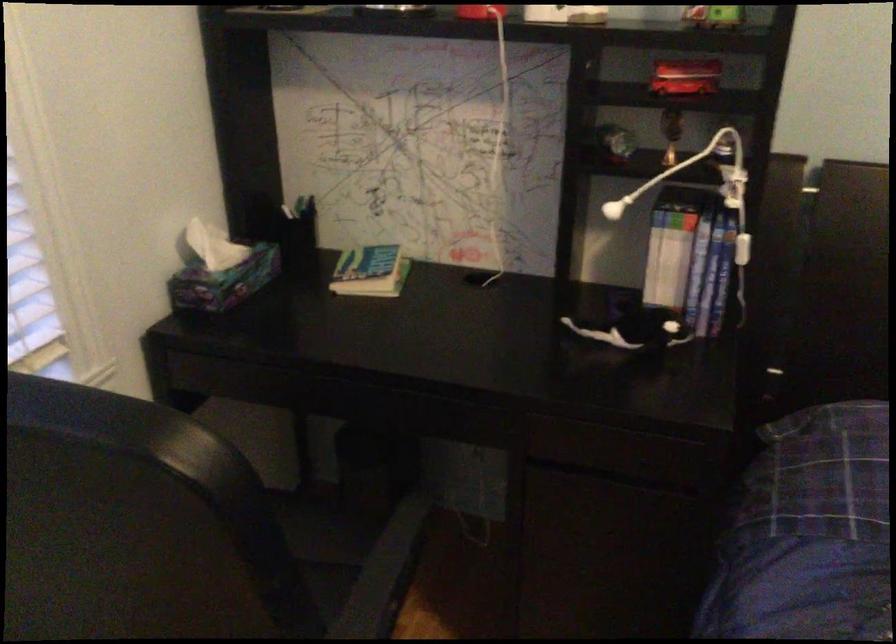
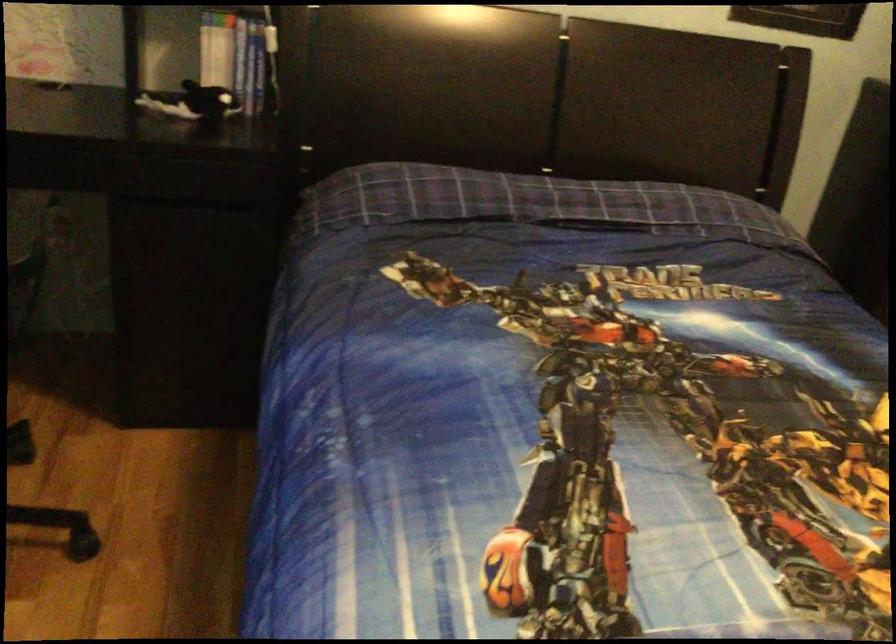
Question: The images are taken continuously from a first-person perspective. In which direction are you moving?

Choices:
 (A) Left
 (B) Right
 (C) Forward
 (D) Backward

Answer: (D)